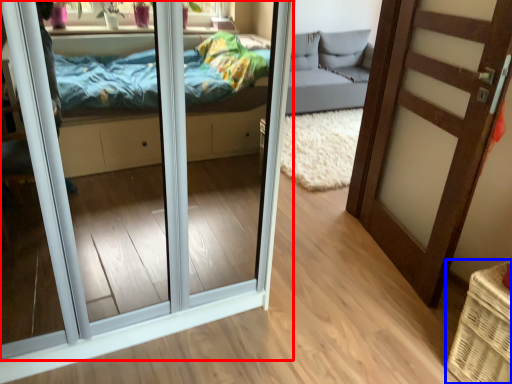
Question: Which of the following is the closest to the observer, door (highlighted by a red box) or basket (highlighted by a blue box)?

Choices:
 (A) door
 (B) basket

Answer: (A)